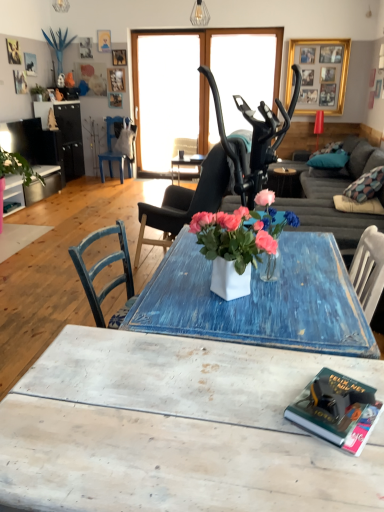
Question: Is matte black chair at center, the first chair viewed from the front, situated inside gold-framed collage at upper center or outside?

Choices:
 (A) inside
 (B) outside

Answer: (B)

Question: From the image's perspective, is matte black chair at center, which appears as the first chair when viewed from the right, located above or below gold-framed collage at upper center?

Choices:
 (A) below
 (B) above

Answer: (A)

Question: Which of these objects is positioned farthest from the blue distressed table at center?

Choices:
 (A) blue fabric pillow at right
 (B) white distressed wood coffee table at lower center
 (C) matte black chair at center, marked as the second chair in a left-to-right arrangement
 (D) transparent glass door at center
 (E) gold-framed collage at upper center

Answer: (B)

Question: Which object is the farthest from the transparent glass door at center?

Choices:
 (A) blue distressed table at center
 (B) hardcover book at lower right
 (C) matte black chair at center, which is the second chair from back to front
 (D) gold-framed collage at upper center
 (E) blue fabric pillow at right

Answer: (B)